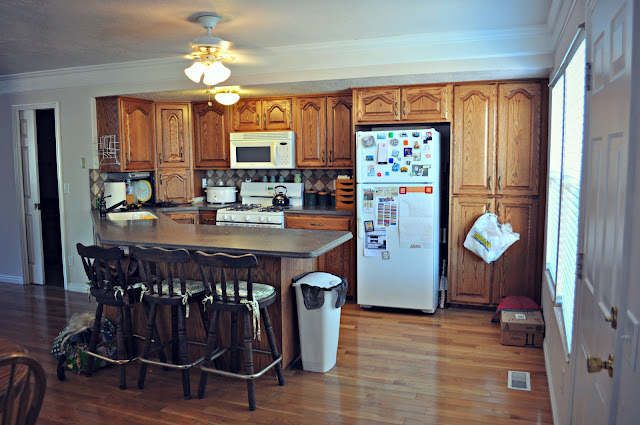
At what (x,y) coordinates should I click in order to perform the action: click on stove. Please return your answer as a coordinate pair (x, y). The height and width of the screenshot is (425, 640). Looking at the image, I should click on (257, 186).